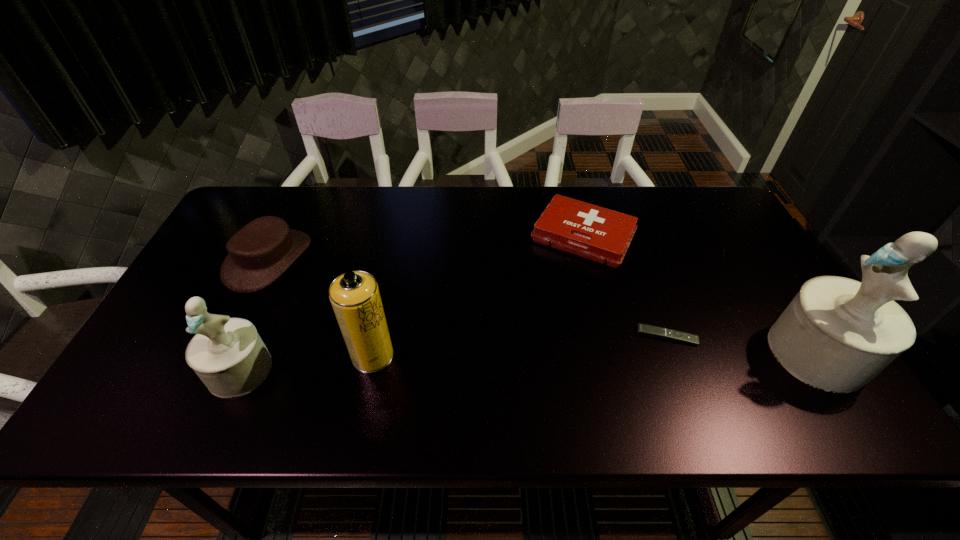
Where is `free space between the shorter figurine and the first-aid kit`? The height and width of the screenshot is (540, 960). free space between the shorter figurine and the first-aid kit is located at coordinates (412, 303).

This screenshot has height=540, width=960. Identify the location of vacant area between the remote control and the first-aid kit. (625, 286).

You are a GUI agent. You are given a task and a screenshot of the screen. Output one action in this format:
    pyautogui.click(x=<x>, y=<y>)
    Task: Click on the vacant area that lies between the first-aid kit and the fourth tallest object
    Image resolution: width=960 pixels, height=540 pixels.
    Given the screenshot: What is the action you would take?
    click(426, 247)

At what (x,y) coordinates should I click in order to perform the action: click on blank region between the first-aid kit and the remote control. Please return your answer as a coordinate pair (x, y). This screenshot has width=960, height=540. Looking at the image, I should click on (625, 286).

Where is `vacant space in between the shorter figurine and the hat`? vacant space in between the shorter figurine and the hat is located at coordinates (254, 315).

Identify the location of unoccupied area between the remote control and the tallest object. (742, 345).

Identify which object is the fourth closest to the shortest object. Please provide its 2D coordinates. Your answer should be formatted as a tuple, i.e. [(x, y)], where the tuple contains the x and y coordinates of a point satisfying the conditions above.

[(228, 355)]

This screenshot has width=960, height=540. I want to click on the closest object to the shortest object, so tap(837, 334).

You are a GUI agent. You are given a task and a screenshot of the screen. Output one action in this format:
    pyautogui.click(x=<x>, y=<y>)
    Task: Click on the vacant space that satisfies the following two spatial constraints: 1. at the beak of the taller figurine; 2. at the beak of the shorter figurine
    Image resolution: width=960 pixels, height=540 pixels.
    Given the screenshot: What is the action you would take?
    pyautogui.click(x=828, y=370)

Find the location of a particular element. blank space that satisfies the following two spatial constraints: 1. on the front side of the aerosol can; 2. on the left side of the third shortest object is located at coordinates (223, 355).